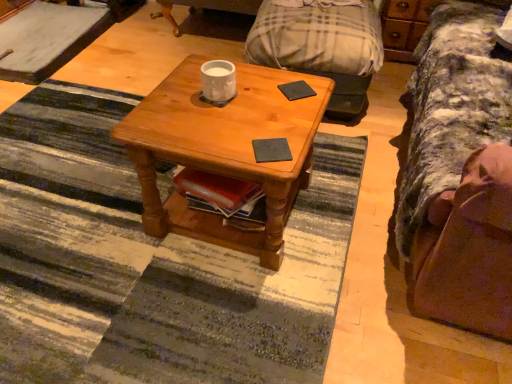
The height and width of the screenshot is (384, 512). What are the coordinates of `free point in front of white glossy mug at center` in the screenshot? It's located at [211, 123].